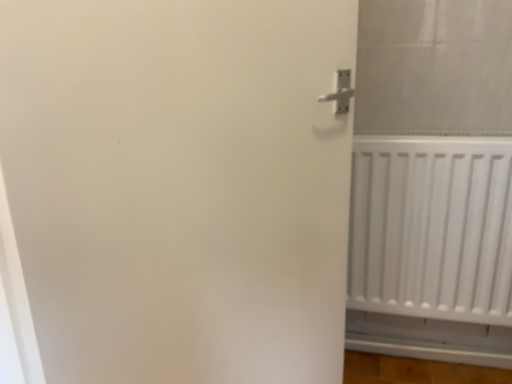
Question: From a real-world perspective, relative to white matte door at right, is white matte radiator at right vertically above or below?

Choices:
 (A) above
 (B) below

Answer: (B)

Question: Is white matte radiator at right in front of or behind white matte door at right in the image?

Choices:
 (A) front
 (B) behind

Answer: (B)

Question: In the image, is white matte radiator at right on the left side or the right side of white matte door at right?

Choices:
 (A) right
 (B) left

Answer: (A)

Question: In the image, is white matte door at right positioned in front of or behind white matte radiator at right?

Choices:
 (A) front
 (B) behind

Answer: (A)

Question: From a real-world perspective, is white matte door at right above or below white matte radiator at right?

Choices:
 (A) above
 (B) below

Answer: (A)

Question: In terms of width, does white matte door at right look wider or thinner when compared to white matte radiator at right?

Choices:
 (A) wide
 (B) thin

Answer: (B)

Question: From their relative heights in the image, would you say white matte door at right is taller or shorter than white matte radiator at right?

Choices:
 (A) short
 (B) tall

Answer: (B)